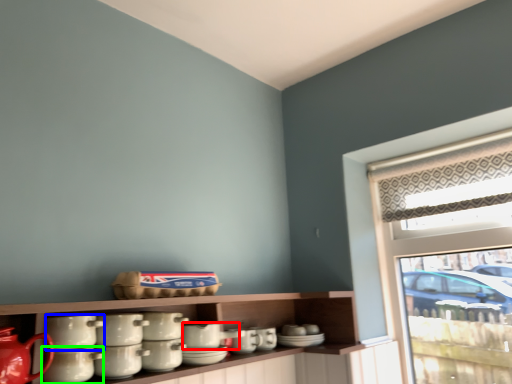
Question: Considering the real-world distances, which object is farthest from tableware (highlighted by a red box)? tableware (highlighted by a blue box) or tableware (highlighted by a green box)?

Choices:
 (A) tableware
 (B) tableware

Answer: (A)